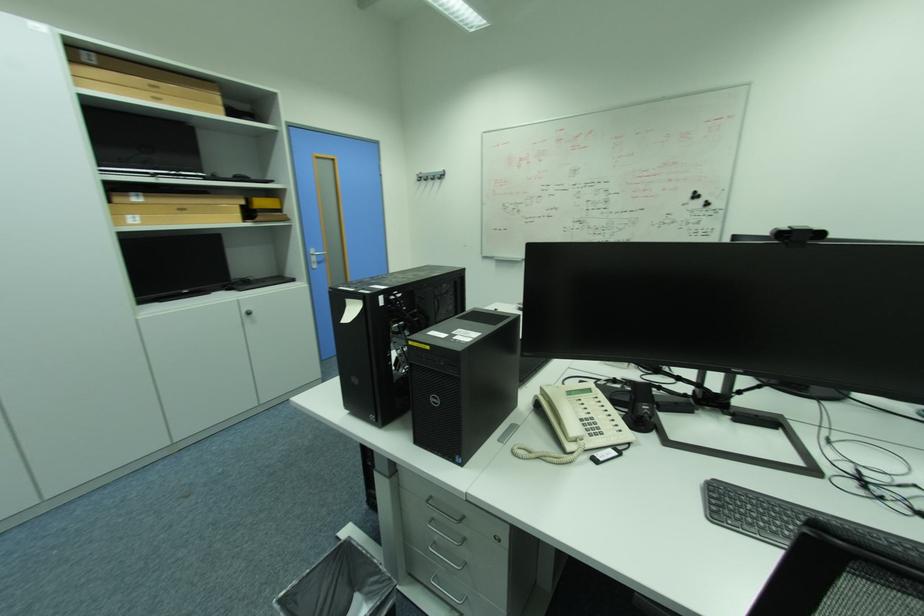
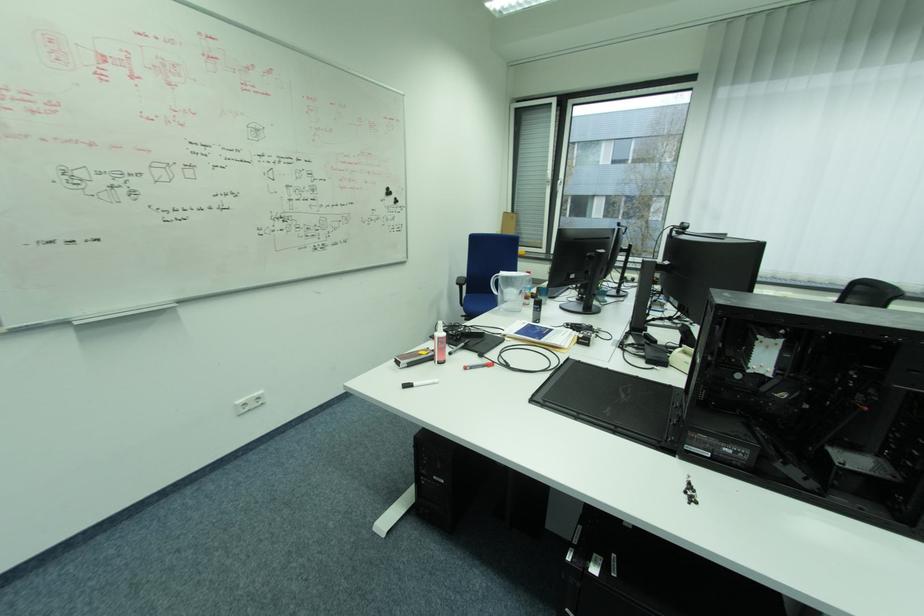
In the second image, find the point that corresponds to (697,196) in the first image.

(392, 192)